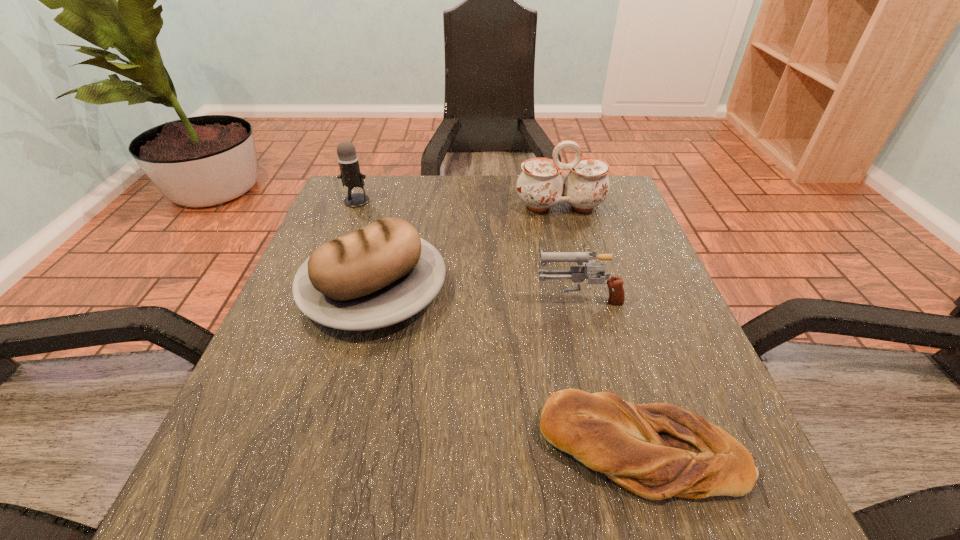
You are a GUI agent. You are given a task and a screenshot of the screen. Output one action in this format:
    pyautogui.click(x=<x>, y=<y>)
    Task: Click on the chinaware
    The image size is (960, 540).
    Given the screenshot: What is the action you would take?
    (540, 186)

Identify the location of microphone. (350, 175).

Identify the location of the farther bread. (382, 274).

You are a GUI agent. You are given a task and a screenshot of the screen. Output one action in this format:
    pyautogui.click(x=<x>, y=<y>)
    Task: Click on the left bread
    The image size is (960, 540).
    Given the screenshot: What is the action you would take?
    pyautogui.click(x=382, y=274)

Locate an element on the screen. gun is located at coordinates (578, 274).

Locate an element on the screen. Image resolution: width=960 pixels, height=540 pixels. the nearest object is located at coordinates click(x=657, y=450).

Locate an element on the screen. The image size is (960, 540). the shorter bread is located at coordinates (657, 450).

This screenshot has height=540, width=960. Find the location of `blank space located 0.400m by the handle of the chinaware`. blank space located 0.400m by the handle of the chinaware is located at coordinates coord(596,348).

I want to click on vacant space situated 0.240m on the front of the microphone, so click(x=330, y=270).

Locate an element on the screen. Image resolution: width=960 pixels, height=540 pixels. vacant region located on the back of the taller bread is located at coordinates (391, 227).